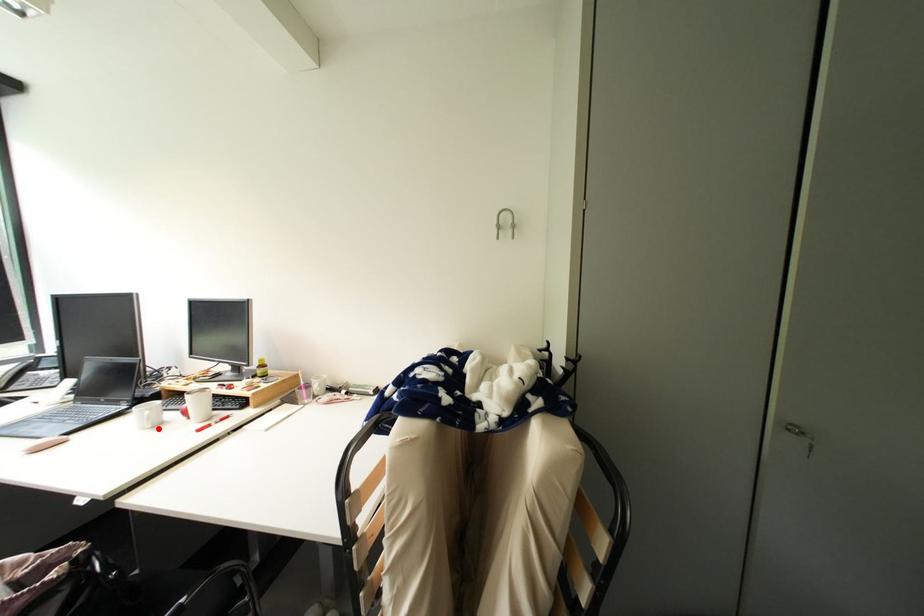
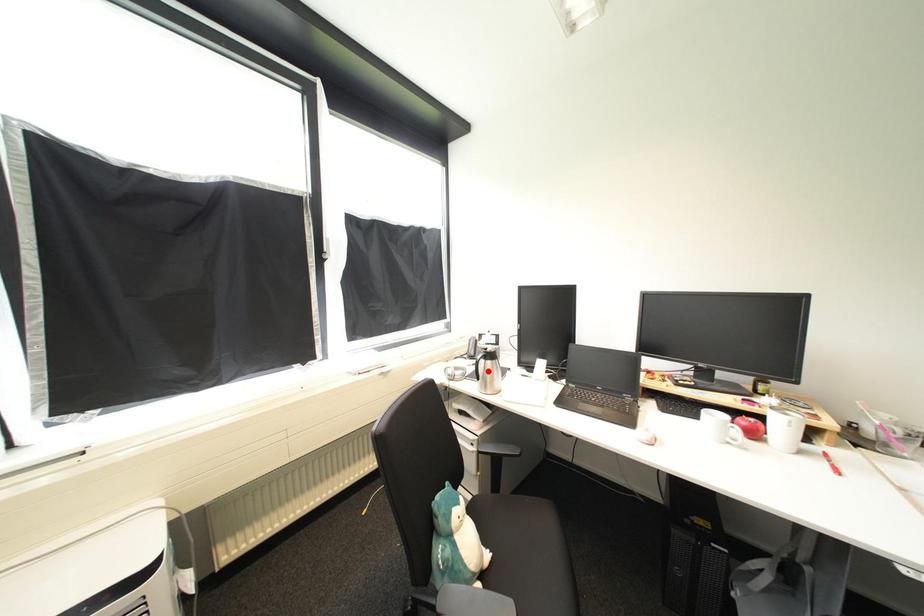
I am providing you with two images of the same scene from different viewpoints. A red point is marked on the first image and another point is marked on the second image. Does the point marked in image1 correspond to the same location as the one in image2?

No